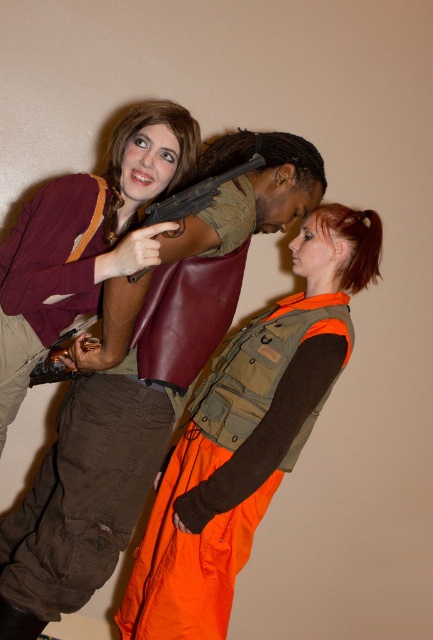
You are an arms dealer who needs to store the matte brown leather jacket at upper left and the matte black shotgun at center in a rectangular box. The box can only accommodate one of them. Which item should you choose to fit in the box if the box is the same size as the smaller object?

The matte black shotgun at center is smaller than the matte brown leather jacket at upper left. Therefore, the box can only fit the matte black shotgun at center.

You are an observer standing in front of the image. You see the orange fabric vest at center and the matte brown leather jacket at upper left. Which object is positioned lower in the image?

The orange fabric vest at center is located below matte brown leather jacket at upper left, so the orange fabric vest at center is positioned lower in the image.